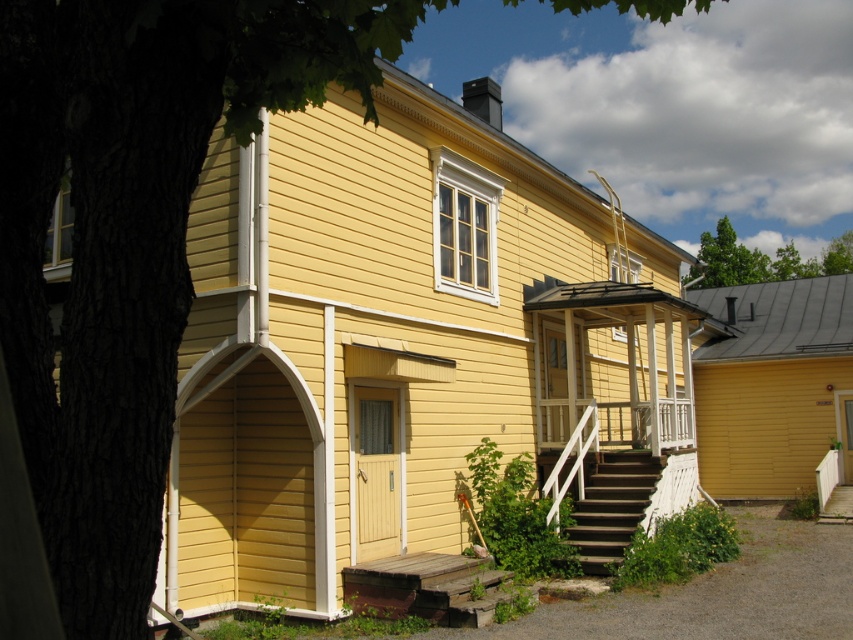
You are standing at the base of the dark brown wooden stairs at lower center and want to look up at the green leafy tree at upper center. Which object will you have to look upwards more to see?

You will have to look upwards more to see the green leafy tree at upper center because it is taller than the dark brown wooden stairs at lower center.